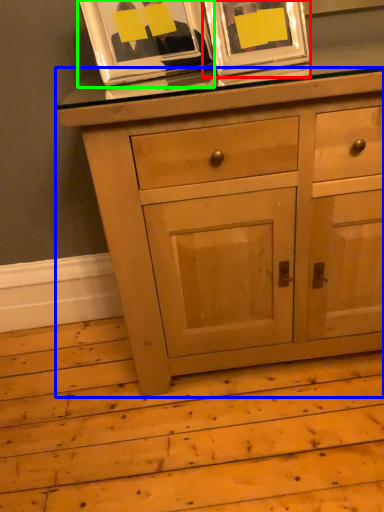
Question: Which object is positioned farthest from picture frame (highlighted by a red box)? Select from chest of drawers (highlighted by a blue box) and picture frame (highlighted by a green box).

Choices:
 (A) chest of drawers
 (B) picture frame

Answer: (A)